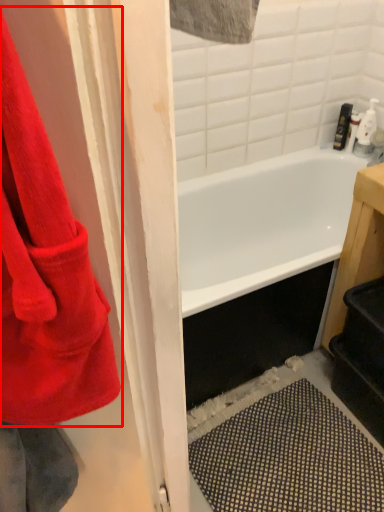
Question: From the image's perspective, what is the correct spatial relationship of towel (annotated by the red box) in relation to toiletry?

Choices:
 (A) below
 (B) above

Answer: (A)